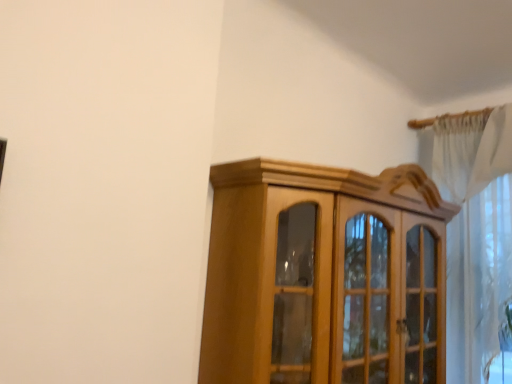
Locate an element on the screen. The height and width of the screenshot is (384, 512). white sheer curtain at upper right is located at coordinates (475, 232).

Describe the element at coordinates (475, 232) in the screenshot. The width and height of the screenshot is (512, 384). I see `white sheer curtain at upper right` at that location.

Measure the distance between light brown wood cabinet at center and camera.

They are 4.24 feet apart.

What do you see at coordinates (324, 275) in the screenshot? I see `light brown wood cabinet at center` at bounding box center [324, 275].

Where is `light brown wood cabinet at center`? This screenshot has height=384, width=512. light brown wood cabinet at center is located at coordinates (324, 275).

Image resolution: width=512 pixels, height=384 pixels. In order to click on white sheer curtain at upper right in this screenshot , I will do `click(475, 232)`.

Considering the relative positions of light brown wood cabinet at center and white sheer curtain at upper right in the image provided, is light brown wood cabinet at center to the right of white sheer curtain at upper right from the viewer's perspective?

In fact, light brown wood cabinet at center is to the left of white sheer curtain at upper right.

Considering the positions of objects light brown wood cabinet at center and white sheer curtain at upper right in the image provided, who is in front, light brown wood cabinet at center or white sheer curtain at upper right?

light brown wood cabinet at center.

Does point (207, 342) come closer to viewer compared to point (486, 353)?

That is True.

From the image's perspective, is light brown wood cabinet at center beneath white sheer curtain at upper right?

Yes, from the image's perspective, light brown wood cabinet at center is beneath white sheer curtain at upper right.

From a real-world perspective, is light brown wood cabinet at center on white sheer curtain at upper right?

No, from a real-world perspective, light brown wood cabinet at center is not over white sheer curtain at upper right

Which of these two, light brown wood cabinet at center or white sheer curtain at upper right, is thinner?

white sheer curtain at upper right.

Can you confirm if light brown wood cabinet at center is taller than white sheer curtain at upper right?

No, light brown wood cabinet at center is not taller than white sheer curtain at upper right.

Who is smaller, light brown wood cabinet at center or white sheer curtain at upper right?

Smaller between the two is white sheer curtain at upper right.

Is light brown wood cabinet at center positioned beyond the bounds of white sheer curtain at upper right?

Absolutely, light brown wood cabinet at center is external to white sheer curtain at upper right.

Is light brown wood cabinet at center far from white sheer curtain at upper right?

No, light brown wood cabinet at center is not far away from white sheer curtain at upper right.

Is light brown wood cabinet at center facing away from white sheer curtain at upper right?

No, light brown wood cabinet at center is not facing the opposite direction of white sheer curtain at upper right.

You are a GUI agent. You are given a task and a screenshot of the screen. Output one action in this format:
    pyautogui.click(x=<x>, y=<y>)
    Task: Click on the cupboard on the left of white sheer curtain at upper right
    This screenshot has width=512, height=384.
    Given the screenshot: What is the action you would take?
    pyautogui.click(x=324, y=275)

Does white sheer curtain at upper right appear on the left side of light brown wood cabinet at center?

No, white sheer curtain at upper right is not to the left of light brown wood cabinet at center.

Considering their positions, is white sheer curtain at upper right located in front of or behind light brown wood cabinet at center?

white sheer curtain at upper right is behind light brown wood cabinet at center.

Between point (487, 293) and point (401, 263), which one is positioned behind?

Point (487, 293)

From the image's perspective, is white sheer curtain at upper right positioned above or below light brown wood cabinet at center?

From the image's perspective, white sheer curtain at upper right appears above light brown wood cabinet at center.

Looking at this image, from a real-world perspective, does white sheer curtain at upper right sit lower than light brown wood cabinet at center?

No.

Which of these two, white sheer curtain at upper right or light brown wood cabinet at center, is wider?

light brown wood cabinet at center.

Who is taller, white sheer curtain at upper right or light brown wood cabinet at center?

white sheer curtain at upper right is taller.

Can you confirm if white sheer curtain at upper right is smaller than light brown wood cabinet at center?

Yes.

Would you say white sheer curtain at upper right is inside or outside light brown wood cabinet at center?

white sheer curtain at upper right can be found inside light brown wood cabinet at center.

Is there a large distance between white sheer curtain at upper right and light brown wood cabinet at center?

They are positioned close to each other.

Is white sheer curtain at upper right positioned with its back to light brown wood cabinet at center?

Yes, white sheer curtain at upper right is positioned with its back facing light brown wood cabinet at center.

The image size is (512, 384). I want to click on cupboard located in front of the white sheer curtain at upper right, so click(324, 275).

Where is `curtain located above the light brown wood cabinet at center (from the image's perspective)`? curtain located above the light brown wood cabinet at center (from the image's perspective) is located at coordinates (475, 232).

You are a GUI agent. You are given a task and a screenshot of the screen. Output one action in this format:
    pyautogui.click(x=<x>, y=<y>)
    Task: Click on the cupboard that appears below the white sheer curtain at upper right (from the image's perspective)
    The image size is (512, 384).
    Given the screenshot: What is the action you would take?
    pyautogui.click(x=324, y=275)